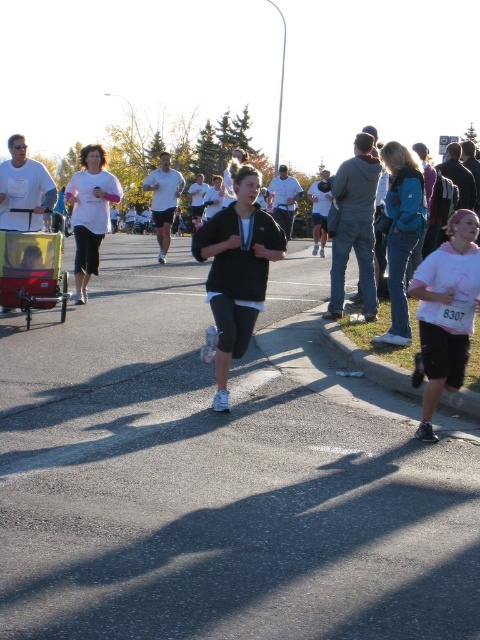
You are a participant in the community run event and want to know if the point at coordinates point (29, 346) is ahead of point (85, 205) along the race route. Can you confirm this based on your position?

Yes, point (29, 346) is in front of point (85, 205) along the race route, so it is ahead.